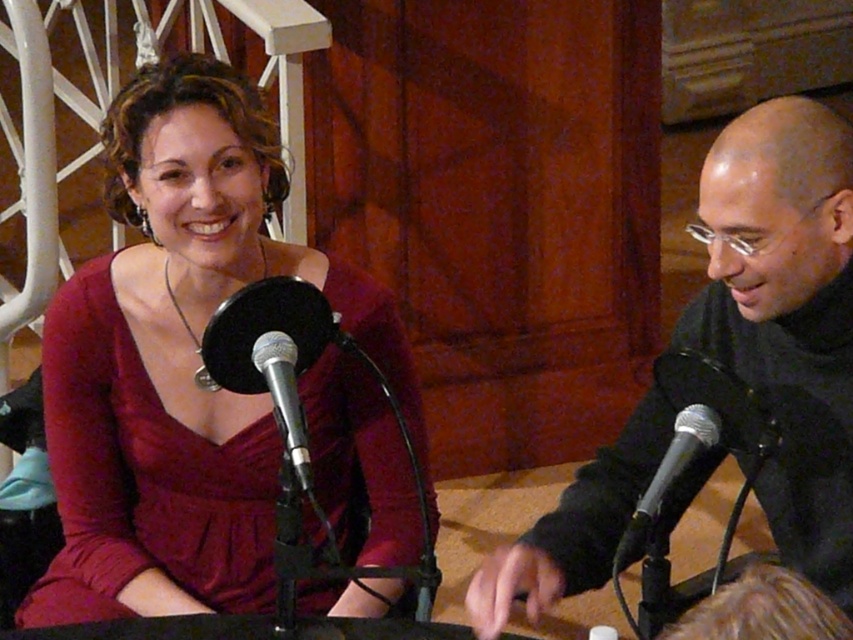
Does matte red dress at center have a lesser height compared to silver metallic microphone at center?

In fact, matte red dress at center may be taller than silver metallic microphone at center.

Does matte red dress at center have a lesser width compared to silver metallic microphone at center?

Incorrect, matte red dress at center's width is not less than silver metallic microphone at center's.

Who is more forward, (242, 112) or (279, 385)?

Point (279, 385)

Image resolution: width=853 pixels, height=640 pixels. In order to click on matte red dress at center in this screenshot , I will do `click(180, 364)`.

Who is higher up, matte red dress at center or black matte jacket at right?

matte red dress at center is above.

How far apart are matte red dress at center and black matte jacket at right?

matte red dress at center and black matte jacket at right are 18.71 inches apart.

In order to click on matte red dress at center in this screenshot , I will do `click(180, 364)`.

What are the coordinates of `matte red dress at center` in the screenshot? It's located at (180, 364).

Is point (390, 492) farther from camera compared to point (640, 499)?

Yes, it is behind point (640, 499).

Between point (135, 401) and point (671, 458), which one is positioned behind?

Point (135, 401)

Measure the distance between matte red dress at center and camera.

The distance of matte red dress at center from camera is 1.30 meters.

The image size is (853, 640). I want to click on matte red dress at center, so click(180, 364).